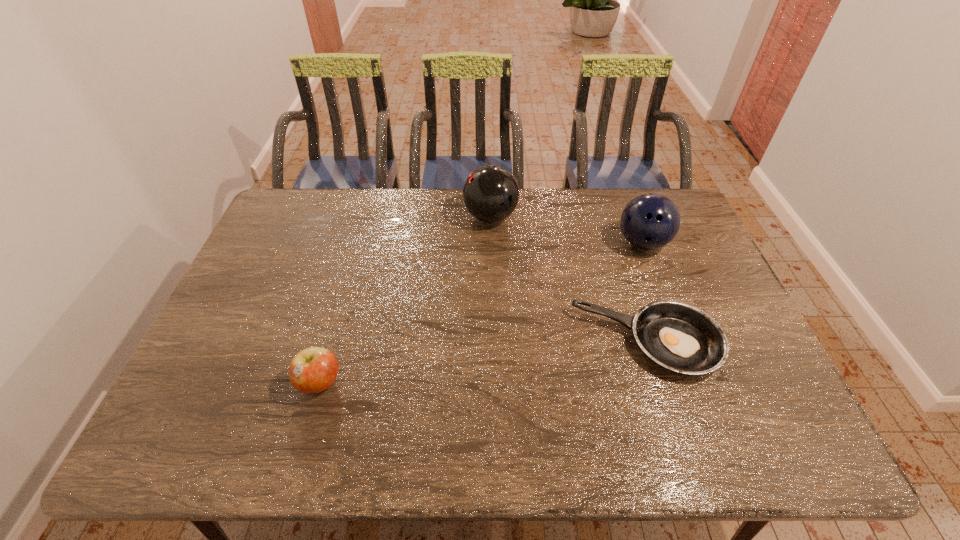
Identify the location of the third object from right to left. Image resolution: width=960 pixels, height=540 pixels. (490, 194).

Find the location of a particular element. The height and width of the screenshot is (540, 960). the right bowling ball is located at coordinates (650, 221).

I want to click on the second shortest object, so click(312, 370).

The image size is (960, 540). I want to click on the leftmost object, so click(312, 370).

Where is `the shortest object`? the shortest object is located at coordinates (680, 337).

Find the location of `free spot located on the surface of the left bowling ball near the finger holes`. free spot located on the surface of the left bowling ball near the finger holes is located at coordinates (366, 217).

You are a GUI agent. You are given a task and a screenshot of the screen. Output one action in this format:
    pyautogui.click(x=<x>, y=<y>)
    Task: Click on the vacant region located on the surface of the left bowling ball near the finger holes
    
    Given the screenshot: What is the action you would take?
    pyautogui.click(x=363, y=217)

At what (x,y) coordinates should I click in order to perform the action: click on vacant space situated on the surface of the left bowling ball near the finger holes. Please return your answer as a coordinate pair (x, y). Image resolution: width=960 pixels, height=540 pixels. Looking at the image, I should click on (406, 217).

Where is `free space located on the surface of the right bowling ball near the finger holes`? The image size is (960, 540). free space located on the surface of the right bowling ball near the finger holes is located at coordinates (654, 273).

The image size is (960, 540). I want to click on vacant space situated on the left of the apple, so click(249, 382).